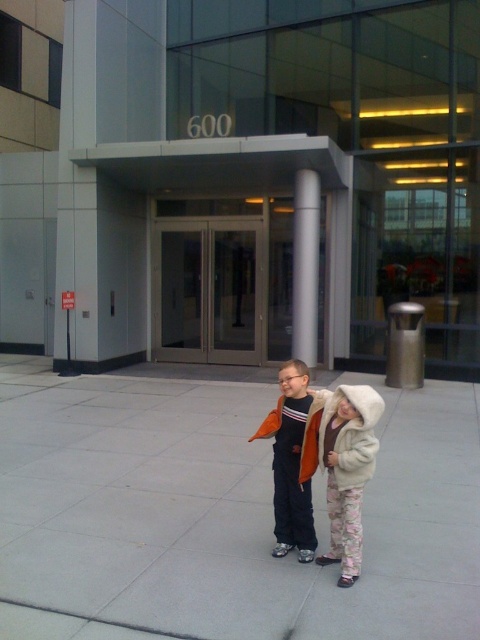
You are a delivery drone that needs to land on the gray concrete pavement at center. What are the coordinates where you should land?

The gray concrete pavement at center is located at coordinates point [222,513], so you should land there.

In the scene shown: You are a delivery robot with a 2 meter wide package. You need to navigate between the two children standing at point (257, 442). Can you pass through the space between them without hitting either?

The two children are 6.85 meters apart, so yes, the delivery robot with a 2 meter wide package can pass through the space between them as there is sufficient distance.